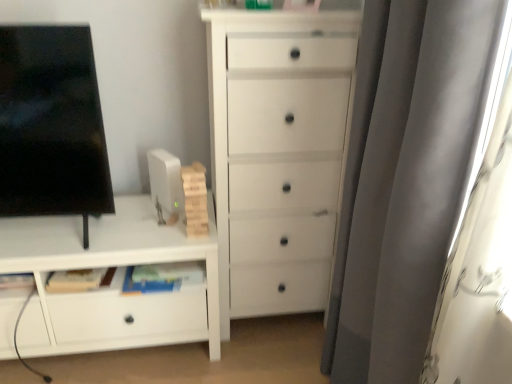
Question: From the image's perspective, is black glossy screen at left on top of white matte cabinet at lower left, which ranks as the 1th chest of drawers in left-to-right order?

Choices:
 (A) yes
 (B) no

Answer: (A)

Question: Does black glossy screen at left have a greater width compared to white matte cabinet at lower left, the second chest of drawers viewed from the right?

Choices:
 (A) yes
 (B) no

Answer: (B)

Question: Does black glossy screen at left have a smaller size compared to white matte cabinet at lower left, the second chest of drawers viewed from the right?

Choices:
 (A) no
 (B) yes

Answer: (B)

Question: From the image's perspective, is black glossy screen at left located beneath white matte cabinet at lower left, the second chest of drawers viewed from the right?

Choices:
 (A) yes
 (B) no

Answer: (B)

Question: Can we say black glossy screen at left lies outside white matte cabinet at lower left, the second chest of drawers viewed from the right?

Choices:
 (A) yes
 (B) no

Answer: (A)

Question: From a real-world perspective, is black glossy screen at left physically located above or below gray velvet curtain at right?

Choices:
 (A) below
 (B) above

Answer: (B)

Question: Is point (41, 180) closer or farther from the camera than point (416, 132)?

Choices:
 (A) farther
 (B) closer

Answer: (A)

Question: From the image's perspective, is black glossy screen at left located above or below gray velvet curtain at right?

Choices:
 (A) above
 (B) below

Answer: (A)

Question: Considering the positions of black glossy screen at left and gray velvet curtain at right in the image, is black glossy screen at left wider or thinner than gray velvet curtain at right?

Choices:
 (A) thin
 (B) wide

Answer: (B)

Question: Is point (415, 67) closer or farther from the camera than point (128, 211)?

Choices:
 (A) farther
 (B) closer

Answer: (B)

Question: From the image's perspective, is gray velvet curtain at right positioned above or below white matte cabinet at lower left, the second chest of drawers viewed from the right?

Choices:
 (A) below
 (B) above

Answer: (B)

Question: In the image, is gray velvet curtain at right on the left side or the right side of white matte cabinet at lower left, the second chest of drawers viewed from the right?

Choices:
 (A) left
 (B) right

Answer: (B)

Question: From a real-world perspective, is gray velvet curtain at right above or below white matte cabinet at lower left, the second chest of drawers viewed from the right?

Choices:
 (A) below
 (B) above

Answer: (B)

Question: From a real-world perspective, is gray velvet curtain at right physically located above or below white matte chest of drawers at center, the 1th chest of drawers from the right?

Choices:
 (A) below
 (B) above

Answer: (B)

Question: In terms of height, does gray velvet curtain at right look taller or shorter compared to white matte chest of drawers at center, which is the 2th chest of drawers from left to right?

Choices:
 (A) short
 (B) tall

Answer: (B)